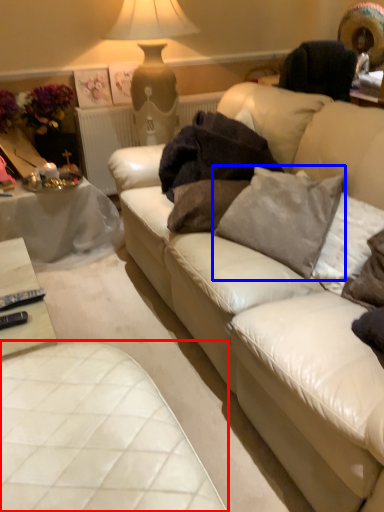
Question: Which point is further to the camera, table (highlighted by a red box) or pillow (highlighted by a blue box)?

Choices:
 (A) table
 (B) pillow

Answer: (B)